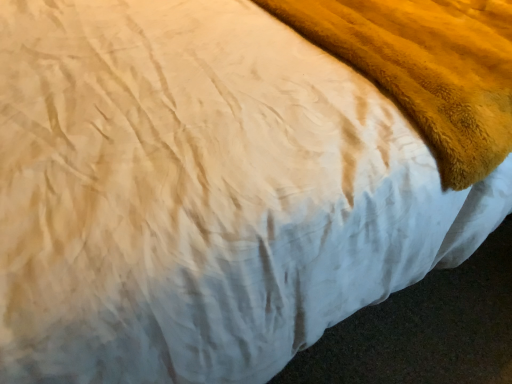
What are the coordinates of `fuzzy yellow blanket at upper right` in the screenshot? It's located at (426, 68).

The image size is (512, 384). What do you see at coordinates (426, 68) in the screenshot?
I see `fuzzy yellow blanket at upper right` at bounding box center [426, 68].

Find the location of a particular element. fuzzy yellow blanket at upper right is located at coordinates (426, 68).